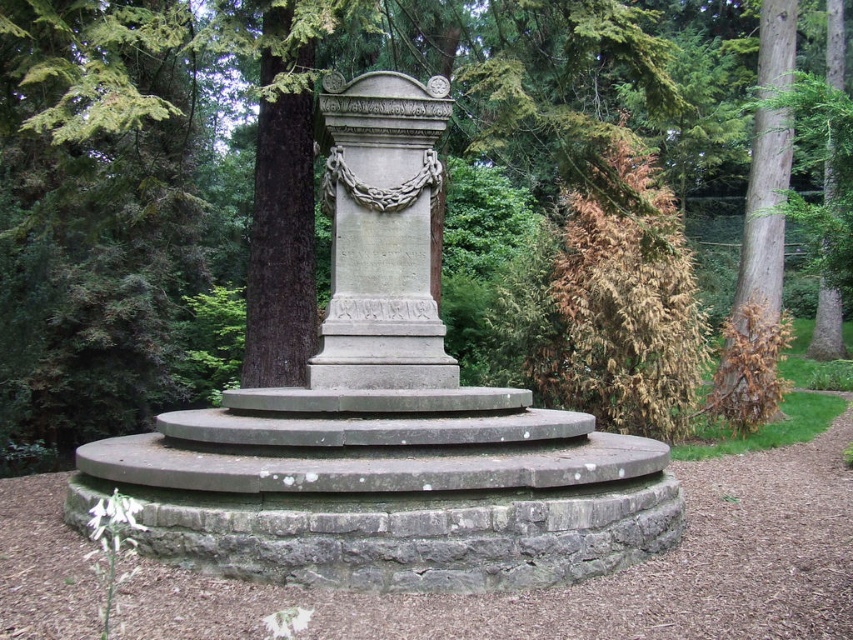
Question: Does gray stone monument at center appear under brown rough bark tree at right?

Choices:
 (A) no
 (B) yes

Answer: (B)

Question: Among these objects, which one is farthest from the camera?

Choices:
 (A) brown rough bark tree at right
 (B) green textured tree at center

Answer: (A)

Question: Estimate the real-world distances between objects in this image. Which object is farther from the green textured tree at center?

Choices:
 (A) brown rough bark tree at right
 (B) gray stone monument at center

Answer: (B)

Question: Which of the following is the closest to the observer?

Choices:
 (A) (424, 250)
 (B) (741, 310)

Answer: (A)

Question: Does green textured tree at center appear on the left side of brown rough bark tree at right?

Choices:
 (A) no
 (B) yes

Answer: (B)

Question: Does green textured tree at center have a larger size compared to gray stone monument at center?

Choices:
 (A) yes
 (B) no

Answer: (A)